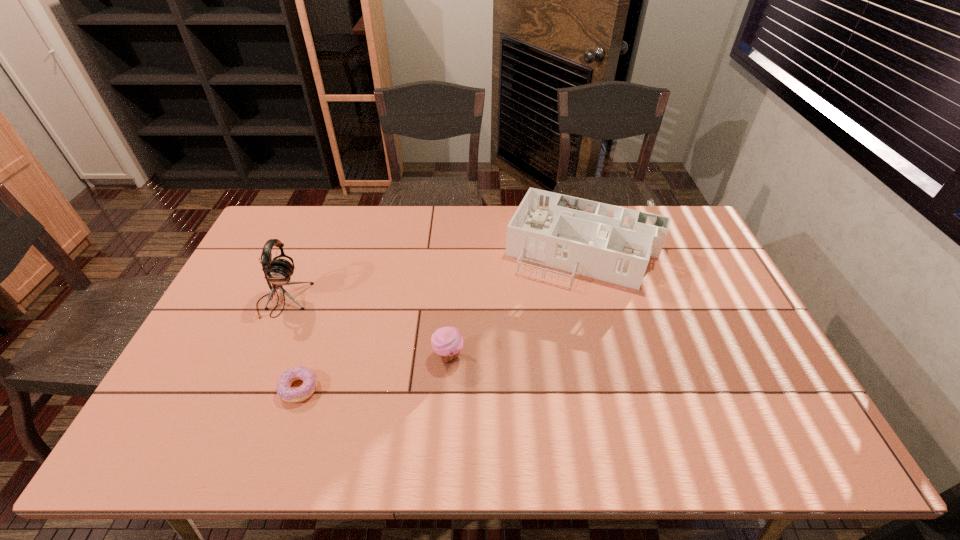
Find the location of a particular element. This screenshot has height=540, width=960. vacant space in between the dollhouse and the leftmost object is located at coordinates (433, 275).

Where is `unoccupied position between the second tallest object and the leftmost object`? The image size is (960, 540). unoccupied position between the second tallest object and the leftmost object is located at coordinates (433, 275).

The width and height of the screenshot is (960, 540). What are the coordinates of `object that is the closest to the third tallest object` in the screenshot? It's located at coord(614,244).

At what (x,y) coordinates should I click in order to perform the action: click on object that stands as the closest to the second tallest object. Please return your answer as a coordinate pair (x, y). Looking at the image, I should click on (447, 342).

This screenshot has width=960, height=540. In order to click on vacant position in the image that satisfies the following two spatial constraints: 1. on the back side of the rightmost object; 2. on the right side of the third farthest object in this screenshot , I will do `click(455, 249)`.

Where is `free location that satisfies the following two spatial constraints: 1. on the back side of the second nearest object; 2. on the right side of the second tallest object`? The width and height of the screenshot is (960, 540). free location that satisfies the following two spatial constraints: 1. on the back side of the second nearest object; 2. on the right side of the second tallest object is located at coordinates (455, 249).

Where is `vacant space that satisfies the following two spatial constraints: 1. on the back side of the dollhouse; 2. on the right side of the earphone`? This screenshot has width=960, height=540. vacant space that satisfies the following two spatial constraints: 1. on the back side of the dollhouse; 2. on the right side of the earphone is located at coordinates (305, 249).